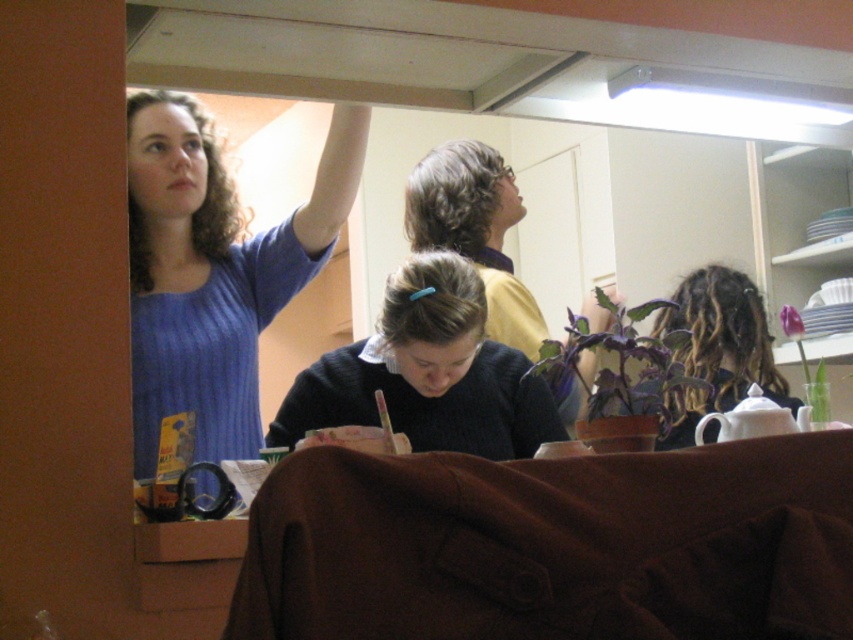
Question: Which object is closer to the camera taking this photo?

Choices:
 (A) blue ribbed sweater at upper left
 (B) dark blue sweater at center
 (C) dark brown dreadlocks at upper right

Answer: (A)

Question: Which object is the farthest from the blue ribbed sweater at upper left?

Choices:
 (A) dark blue sweater at center
 (B) black sweater at center

Answer: (B)

Question: Does dark blue sweater at center have a smaller size compared to dark brown dreadlocks at upper right?

Choices:
 (A) no
 (B) yes

Answer: (B)

Question: Which object is closer to the camera taking this photo?

Choices:
 (A) dark brown dreadlocks at upper right
 (B) blue ribbed sweater at upper left
 (C) dark blue sweater at center
 (D) black sweater at center

Answer: (B)

Question: Is dark blue sweater at center to the left of dark brown dreadlocks at upper right from the viewer's perspective?

Choices:
 (A) yes
 (B) no

Answer: (A)

Question: Does dark blue sweater at center come behind dark brown dreadlocks at upper right?

Choices:
 (A) no
 (B) yes

Answer: (A)